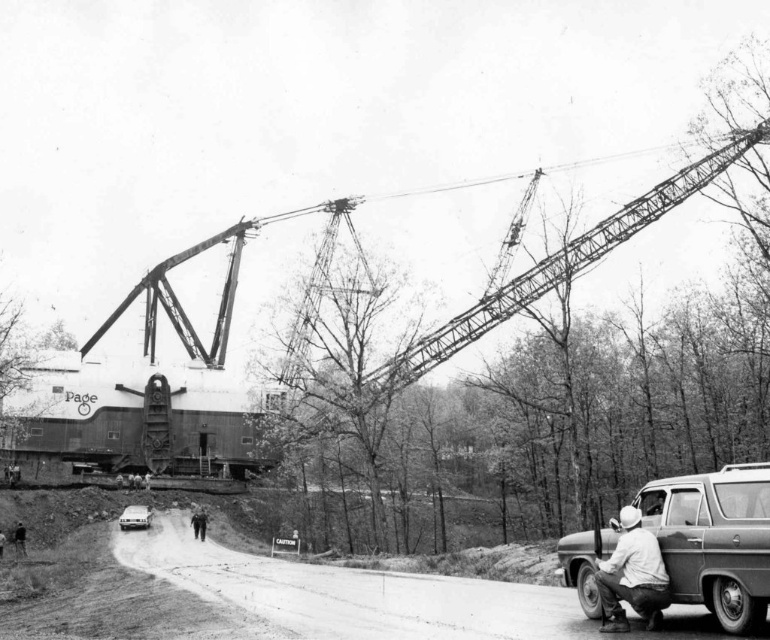
Question: Estimate the real-world distances between objects in this image. Which object is closer to the white matte car at center?

Choices:
 (A) rubber/smooth tire at lower right
 (B) metallic silver van at lower right

Answer: (B)

Question: Which of the following is the farthest from the observer?

Choices:
 (A) white matte shirt at lower right
 (B) metallic trailer truck at center
 (C) white matte car at center
 (D) metallic silver van at lower right

Answer: (B)

Question: In this image, where is white matte shirt at lower right located relative to rubber/smooth tire at lower right?

Choices:
 (A) above
 (B) below

Answer: (A)

Question: Can you confirm if metallic trailer truck at center is bigger than white matte shirt at lower right?

Choices:
 (A) yes
 (B) no

Answer: (A)

Question: Can you confirm if metallic trailer truck at center is positioned above white matte shirt at lower right?

Choices:
 (A) yes
 (B) no

Answer: (A)

Question: Which of the following is the closest to the observer?

Choices:
 (A) rubber/smooth tire at lower right
 (B) metallic trailer truck at center
 (C) metallic silver van at lower right

Answer: (C)